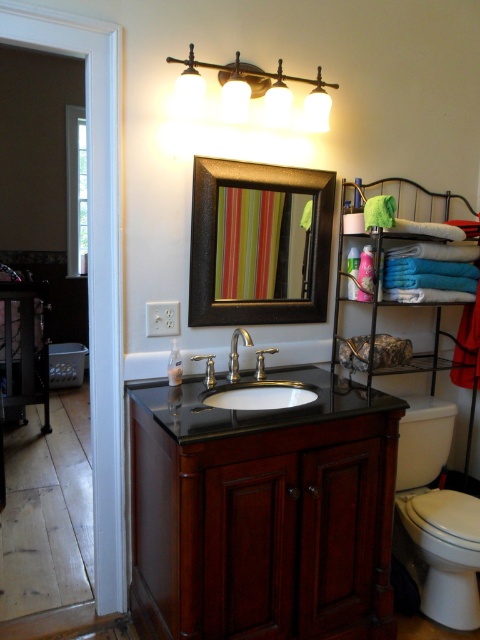
Question: Does white glossy toilet bowl at lower right appear under polished chrome faucet at center?

Choices:
 (A) no
 (B) yes

Answer: (B)

Question: Which object is farther from the camera taking this photo?

Choices:
 (A) black polished granite sink at center
 (B) polished chrome faucet at center
 (C) matte gold light fixture at upper center

Answer: (A)

Question: Can you confirm if dark wood vanity at center is wider than wooden-framed mirror at center?

Choices:
 (A) yes
 (B) no

Answer: (A)

Question: Can you confirm if dark wood vanity at center is smaller than wooden-framed mirror at center?

Choices:
 (A) no
 (B) yes

Answer: (A)

Question: Among these objects, which one is farthest from the camera?

Choices:
 (A) black polished granite sink at center
 (B) wooden-framed mirror at center
 (C) polished chrome faucet at center

Answer: (B)

Question: Which is nearer to the white glossy toilet bowl at lower right?

Choices:
 (A) wooden-framed mirror at center
 (B) polished chrome faucet at center
 (C) dark wood vanity at center

Answer: (C)